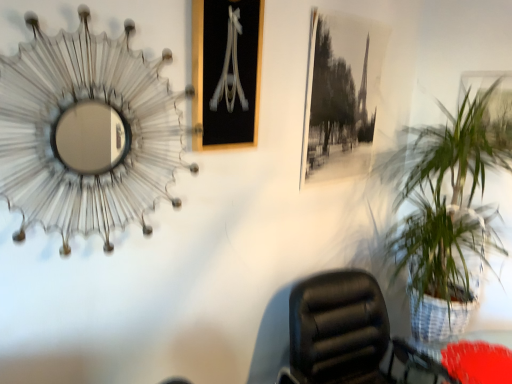
Find the location of a particular element. The image size is (512, 384). black glass picture frame at upper center, which ranks as the third picture frame in right-to-left order is located at coordinates (226, 72).

Describe the element at coordinates (447, 210) in the screenshot. I see `green leafy plant in woven basket at right` at that location.

Consider the image. In order to face red fabric round table at lower right, should I rotate leftwards or rightwards?

It's best to rotate right around 29.431 degrees.

The height and width of the screenshot is (384, 512). Describe the element at coordinates (341, 96) in the screenshot. I see `black paper picture frame at upper center, arranged as the 2th picture frame when viewed from the right` at that location.

This screenshot has width=512, height=384. Describe the element at coordinates (343, 333) in the screenshot. I see `black leather chair at lower right` at that location.

I want to click on black glass picture frame at upper center, the 1th picture frame viewed from the left, so click(226, 72).

In the scene shown: Considering the sizes of black leather chair at lower right and black glass picture frame at upper center, which ranks as the third picture frame in right-to-left order, in the image, is black leather chair at lower right bigger or smaller than black glass picture frame at upper center, which ranks as the third picture frame in right-to-left order,?

In the image, black leather chair at lower right appears to be larger than black glass picture frame at upper center, which ranks as the third picture frame in right-to-left order.

From the image's perspective, which one is positioned lower, black leather chair at lower right or black glass picture frame at upper center, the 1th picture frame viewed from the left?

black leather chair at lower right is shown below in the image.

How far apart are black leather chair at lower right and black glass picture frame at upper center, the 1th picture frame viewed from the left?

They are 36.21 inches apart.

Considering the sizes of black leather chair at lower right and black glass picture frame at upper center, which ranks as the third picture frame in right-to-left order, in the image, is black leather chair at lower right wider or thinner than black glass picture frame at upper center, which ranks as the third picture frame in right-to-left order,?

black leather chair at lower right is wider than black glass picture frame at upper center, which ranks as the third picture frame in right-to-left order.

Which is behind, point (365, 325) or point (420, 349)?

Positioned behind is point (420, 349).

Could you tell me if black leather chair at lower right is facing red fabric round table at lower right?

No, black leather chair at lower right is not turned towards red fabric round table at lower right.

Identify the location of round table above the black leather chair at lower right (from the image's perspective). (421, 362).

Which is more to the right, black leather chair at lower right or red fabric round table at lower right?

red fabric round table at lower right is more to the right.

What's the angular difference between black paper picture frame at upper center, arranged as the 2th picture frame when viewed from the right, and black leather chair at lower right's facing directions?

The angular difference between black paper picture frame at upper center, arranged as the 2th picture frame when viewed from the right, and black leather chair at lower right is 12.2 degrees.

Locate an element on the screen. This screenshot has width=512, height=384. picture frame that is the 2nd object located behind the black leather chair at lower right is located at coordinates [x=341, y=96].

Based on the photo, is black paper picture frame at upper center, arranged as the 2th picture frame when viewed from the right, shorter than black leather chair at lower right?

No, black paper picture frame at upper center, arranged as the 2th picture frame when viewed from the right, is not shorter than black leather chair at lower right.

Is black paper picture frame at upper center, arranged as the 2th picture frame when viewed from the right, facing towards black leather chair at lower right?

No, black paper picture frame at upper center, arranged as the 2th picture frame when viewed from the right, is not turned towards black leather chair at lower right.

Who is taller, red fabric round table at lower right or black leather chair at lower right?

black leather chair at lower right.

From the image's perspective, which object appears higher, red fabric round table at lower right or black leather chair at lower right?

red fabric round table at lower right is shown above in the image.

In the scene shown: Is red fabric round table at lower right far away from black leather chair at lower right?

A: red fabric round table at lower right is actually quite close to black leather chair at lower right.

How many degrees apart are the facing directions of red fabric round table at lower right and black leather chair at lower right?

red fabric round table at lower right and black leather chair at lower right are facing 16.3 degrees away from each other.

Is the depth of red fabric round table at lower right less than that of metallic silver picture frame at upper right, positioned as the 1th picture frame in right-to-left order?

Yes, it is.

Is red fabric round table at lower right bigger or smaller than metallic silver picture frame at upper right, positioned as the 1th picture frame in right-to-left order?

red fabric round table at lower right is smaller than metallic silver picture frame at upper right, positioned as the 1th picture frame in right-to-left order.

Considering the sizes of objects red fabric round table at lower right and metallic silver picture frame at upper right, positioned as the 1th picture frame in right-to-left order, in the image provided, who is taller, red fabric round table at lower right or metallic silver picture frame at upper right, positioned as the 1th picture frame in right-to-left order,?

metallic silver picture frame at upper right, positioned as the 1th picture frame in right-to-left order.

Can you tell me how much red fabric round table at lower right and metallic silver picture frame at upper right, marked as the third picture frame in a left-to-right arrangement, differ in facing direction?

There is a 94.1-degree angle between the facing directions of red fabric round table at lower right and metallic silver picture frame at upper right, marked as the third picture frame in a left-to-right arrangement.

Consider the image. Can you confirm if metallic wireframe mirror at upper left is taller than black paper picture frame at upper center, which ranks as the 2th picture frame in left-to-right order?

In fact, metallic wireframe mirror at upper left may be shorter than black paper picture frame at upper center, which ranks as the 2th picture frame in left-to-right order.

From the picture: Considering the sizes of objects metallic wireframe mirror at upper left and black paper picture frame at upper center, which ranks as the 2th picture frame in left-to-right order, in the image provided, who is smaller, metallic wireframe mirror at upper left or black paper picture frame at upper center, which ranks as the 2th picture frame in left-to-right order,?

black paper picture frame at upper center, which ranks as the 2th picture frame in left-to-right order.

Which is correct: metallic wireframe mirror at upper left is inside black paper picture frame at upper center, arranged as the 2th picture frame when viewed from the right, or outside of it?

The correct answer is: outside.

Is metallic wireframe mirror at upper left positioned behind black paper picture frame at upper center, which ranks as the 2th picture frame in left-to-right order?

That is False.

From a real-world perspective, is black paper picture frame at upper center, which ranks as the 2th picture frame in left-to-right order, positioned above or below metallic silver picture frame at upper right, positioned as the 1th picture frame in right-to-left order?

black paper picture frame at upper center, which ranks as the 2th picture frame in left-to-right order, is above metallic silver picture frame at upper right, positioned as the 1th picture frame in right-to-left order.

In the scene shown: From the image's perspective, is black paper picture frame at upper center, which ranks as the 2th picture frame in left-to-right order, positioned above or below metallic silver picture frame at upper right, marked as the third picture frame in a left-to-right arrangement?

Clearly, from the image's perspective, black paper picture frame at upper center, which ranks as the 2th picture frame in left-to-right order, is above metallic silver picture frame at upper right, marked as the third picture frame in a left-to-right arrangement.

Is black paper picture frame at upper center, arranged as the 2th picture frame when viewed from the right, bigger or smaller than metallic silver picture frame at upper right, marked as the third picture frame in a left-to-right arrangement?

Considering their sizes, black paper picture frame at upper center, arranged as the 2th picture frame when viewed from the right, takes up more space than metallic silver picture frame at upper right, marked as the third picture frame in a left-to-right arrangement.

Considering the positions of point (369, 137) and point (473, 97), is point (369, 137) closer or farther from the camera than point (473, 97)?

Point (369, 137) appears to be farther away from the viewer than point (473, 97).

The height and width of the screenshot is (384, 512). I want to click on the 2nd picture frame counting from the left side of the black leather chair at lower right, so (226, 72).

Identify the location of chair below the red fabric round table at lower right (from a real-world perspective). (343, 333).

Estimate the real-world distances between objects in this image. Which object is closer to red fabric round table at lower right, black paper picture frame at upper center, which ranks as the 2th picture frame in left-to-right order, or black glass picture frame at upper center, which ranks as the third picture frame in right-to-left order?

black paper picture frame at upper center, which ranks as the 2th picture frame in left-to-right order, lies closer to red fabric round table at lower right than the other object.

Based on the photo, based on their spatial positions, is black paper picture frame at upper center, arranged as the 2th picture frame when viewed from the right, or red fabric round table at lower right closer to black leather chair at lower right?

The object closer to black leather chair at lower right is red fabric round table at lower right.

Considering their positions, is metallic wireframe mirror at upper left positioned further to black glass picture frame at upper center, the 1th picture frame viewed from the left, than black paper picture frame at upper center, which ranks as the 2th picture frame in left-to-right order?

black paper picture frame at upper center, which ranks as the 2th picture frame in left-to-right order.

Looking at the image, which one is located further to green leafy plant in woven basket at right, metallic wireframe mirror at upper left or black glass picture frame at upper center, the 1th picture frame viewed from the left?

metallic wireframe mirror at upper left lies further to green leafy plant in woven basket at right than the other object.

From the image, which object appears to be farther from black glass picture frame at upper center, the 1th picture frame viewed from the left, metallic silver picture frame at upper right, marked as the third picture frame in a left-to-right arrangement, or metallic wireframe mirror at upper left?

metallic silver picture frame at upper right, marked as the third picture frame in a left-to-right arrangement, is positioned further to the anchor black glass picture frame at upper center, the 1th picture frame viewed from the left.

Which object lies further to the anchor point red fabric round table at lower right, black paper picture frame at upper center, which ranks as the 2th picture frame in left-to-right order, or green leafy plant in woven basket at right?

Based on the image, black paper picture frame at upper center, which ranks as the 2th picture frame in left-to-right order, appears to be further to red fabric round table at lower right.

From the image, which object appears to be farther from green leafy plant in woven basket at right, red fabric round table at lower right or black glass picture frame at upper center, which ranks as the third picture frame in right-to-left order?

black glass picture frame at upper center, which ranks as the third picture frame in right-to-left order, lies further to green leafy plant in woven basket at right than the other object.

Which object lies nearer to the anchor point red fabric round table at lower right, green leafy plant in woven basket at right or metallic wireframe mirror at upper left?

The object closer to red fabric round table at lower right is green leafy plant in woven basket at right.

Where is `houseplant between metallic wireframe mirror at upper left and metallic silver picture frame at upper right, positioned as the 1th picture frame in right-to-left order, in the horizontal direction`? Image resolution: width=512 pixels, height=384 pixels. houseplant between metallic wireframe mirror at upper left and metallic silver picture frame at upper right, positioned as the 1th picture frame in right-to-left order, in the horizontal direction is located at coordinates (447, 210).

I want to click on houseplant between black paper picture frame at upper center, which ranks as the 2th picture frame in left-to-right order, and metallic silver picture frame at upper right, positioned as the 1th picture frame in right-to-left order, from left to right, so click(x=447, y=210).

Where is `mirror between black glass picture frame at upper center, which ranks as the third picture frame in right-to-left order, and black leather chair at lower right from top to bottom`? The image size is (512, 384). mirror between black glass picture frame at upper center, which ranks as the third picture frame in right-to-left order, and black leather chair at lower right from top to bottom is located at coordinates (87, 132).

The image size is (512, 384). I want to click on picture frame between metallic wireframe mirror at upper left and black paper picture frame at upper center, arranged as the 2th picture frame when viewed from the right, so click(226, 72).